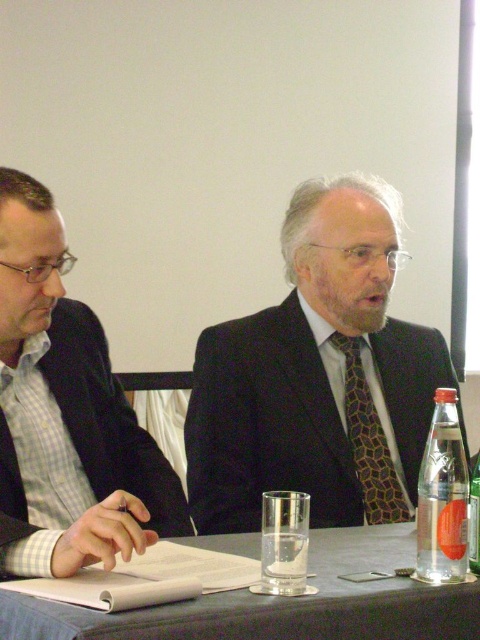
You are a photographer standing at the origin point of the coordinate system. You want to take a photo of the matte black jacket at left. What are the coordinates where you should aim your camera?

The coordinates to aim your camera are at point (x=64, y=413).

You are a server at a formal event and need to place a new water bottle on the table. The existing items include the brown textured tie at center and the clear glass bottle at right. Where should you place the new bottle to ensure it doesn not block the view of the tie?

Place the new bottle in front of the clear glass bottle at right, since the clear glass bottle at right is already positioned behind the brown textured tie at center, placing the new bottle in front would keep it from blocking the tie.